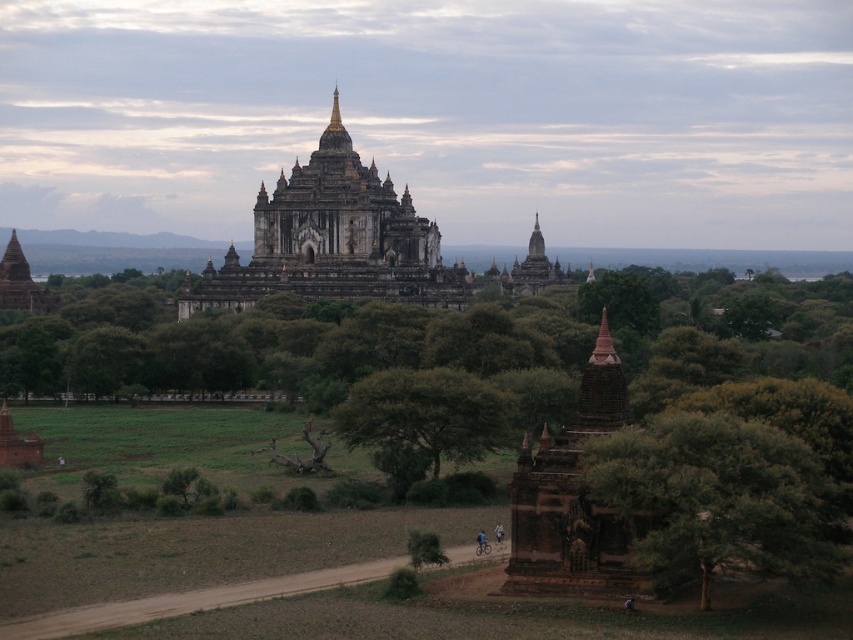
You are a tourist standing at the edge of the forest looking at the green leafy tree at lower right and the stone temple at center. Which object is wider?

The stone temple at center is wider than the green leafy tree at lower right.